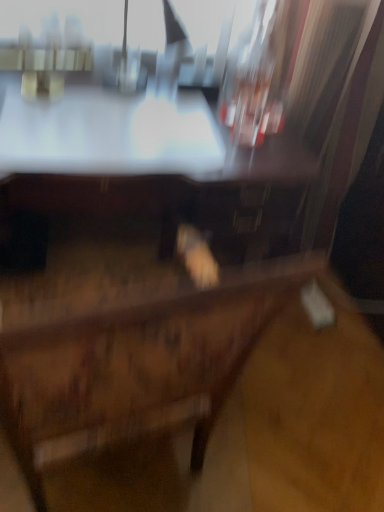
Where is `free space above wooden table at center (from a real-world perspective)`? This screenshot has height=512, width=384. free space above wooden table at center (from a real-world perspective) is located at coordinates [x=101, y=117].